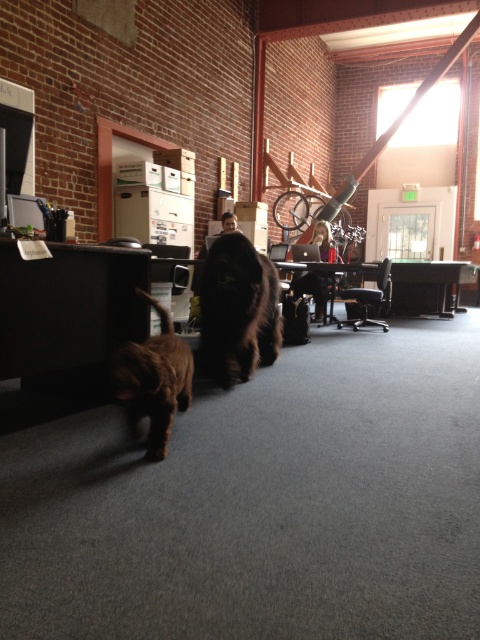
Is point (222, 292) in front of point (280, 241)?

Yes, point (222, 292) is in front of point (280, 241).

Which is in front, point (208, 294) or point (288, 248)?

Point (208, 294) is in front.

Where is `shiny brown fur at center`? The width and height of the screenshot is (480, 640). shiny brown fur at center is located at coordinates (238, 310).

Who is lower down, brown furry dog at lower left or matte black monitor at center?

Positioned lower is brown furry dog at lower left.

This screenshot has width=480, height=640. What do you see at coordinates (154, 380) in the screenshot?
I see `brown furry dog at lower left` at bounding box center [154, 380].

Measure the distance between point (151, 376) and camera.

Point (151, 376) is 6.37 feet away from camera.

The image size is (480, 640). I want to click on brown furry dog at lower left, so click(154, 380).

Consider the image. Does shiny brown fur at center have a lesser width compared to silver metallic laptop at center?

No, shiny brown fur at center is not thinner than silver metallic laptop at center.

Does shiny brown fur at center have a greater height compared to silver metallic laptop at center?

Yes, shiny brown fur at center is taller than silver metallic laptop at center.

Image resolution: width=480 pixels, height=640 pixels. Describe the element at coordinates (238, 310) in the screenshot. I see `shiny brown fur at center` at that location.

Where is `shiny brown fur at center`? shiny brown fur at center is located at coordinates (238, 310).